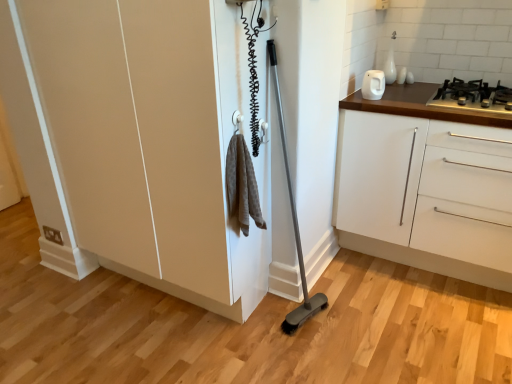
Identify the location of vacant space to the right of matte beige cupboard at center. The width and height of the screenshot is (512, 384). (322, 324).